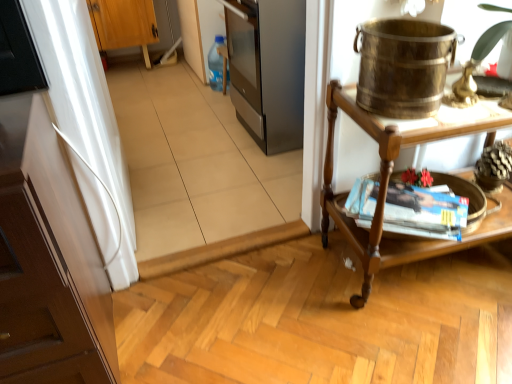
Question: From a real-world perspective, is brass metallic bucket at upper right positioned above or below matte brown magazine at right?

Choices:
 (A) above
 (B) below

Answer: (A)

Question: Does point (373, 46) appear closer or farther from the camera than point (411, 210)?

Choices:
 (A) closer
 (B) farther

Answer: (A)

Question: Based on their relative distances, which object is farther from the wooden table at right?

Choices:
 (A) white glossy cabinet at left, the first cabinetry when ordered from bottom to top
 (B) matte brown magazine at right
 (C) brass metallic bucket at upper right
 (D) wooden cabinet at upper left, marked as the 1th cabinetry in a back-to-front arrangement

Answer: (D)

Question: Estimate the real-world distances between objects in this image. Which object is closer to the wooden cabinet at upper left, which appears as the 1th cabinetry when viewed from the left?

Choices:
 (A) white glossy cabinet at left, the second cabinetry in the back-to-front sequence
 (B) matte brown magazine at right
 (C) wooden table at right
 (D) brass metallic bucket at upper right

Answer: (A)